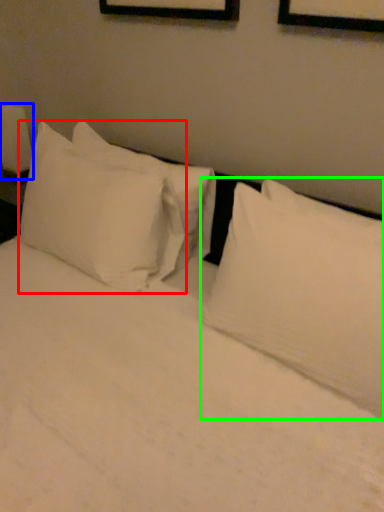
Question: Which object is positioned farthest from pillow (highlighted by a red box)? Select from bedside lamp (highlighted by a blue box) and pillow (highlighted by a green box).

Choices:
 (A) bedside lamp
 (B) pillow

Answer: (A)